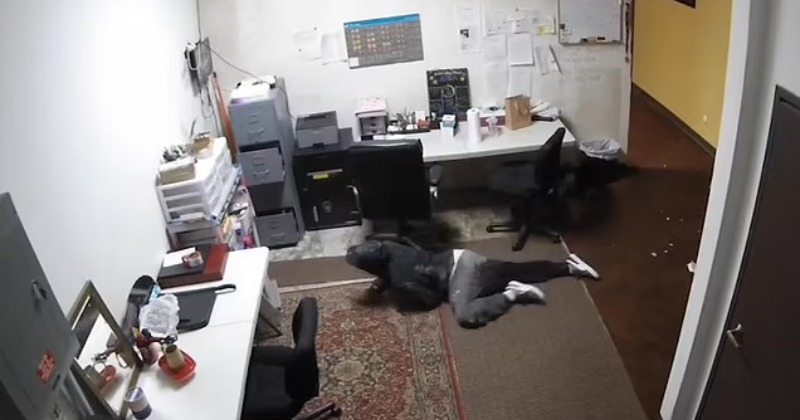
At what (x,y) coordinates should I click in order to perform the action: click on plastic organizer bins. Please return your answer as a coordinate pair (x, y). Looking at the image, I should click on (213, 177).